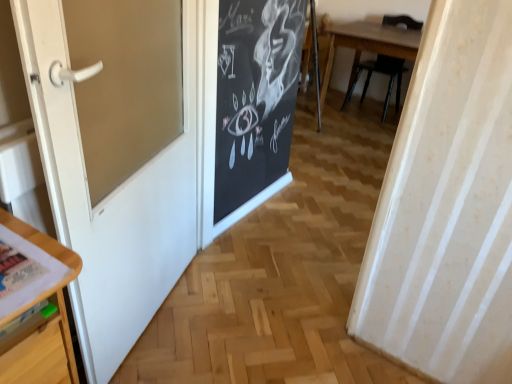
Question: From the image's perspective, does wooden chair at upper right appear lower than white glossy door at left?

Choices:
 (A) no
 (B) yes

Answer: (A)

Question: Is the position of wooden chair at upper right more distant than that of white glossy door at left?

Choices:
 (A) yes
 (B) no

Answer: (A)

Question: Considering the relative positions of wooden chair at upper right and white glossy door at left in the image provided, is wooden chair at upper right to the left of white glossy door at left from the viewer's perspective?

Choices:
 (A) no
 (B) yes

Answer: (A)

Question: Is wooden chair at upper right turned away from white glossy door at left?

Choices:
 (A) no
 (B) yes

Answer: (A)

Question: From a real-world perspective, is wooden chair at upper right located higher than white glossy door at left?

Choices:
 (A) yes
 (B) no

Answer: (B)

Question: From the image's perspective, is wooden chair at upper right located above white glossy door at left?

Choices:
 (A) yes
 (B) no

Answer: (A)

Question: From the image's perspective, is white glossy door at left under wooden chair at upper right?

Choices:
 (A) no
 (B) yes

Answer: (B)

Question: Does white glossy door at left appear on the left side of wooden chair at upper right?

Choices:
 (A) yes
 (B) no

Answer: (A)

Question: Is white glossy door at left closer to the viewer compared to wooden chair at upper right?

Choices:
 (A) yes
 (B) no

Answer: (A)

Question: Does white glossy door at left have a greater width compared to wooden chair at upper right?

Choices:
 (A) no
 (B) yes

Answer: (A)

Question: Considering the relative sizes of white glossy door at left and wooden chair at upper right in the image provided, is white glossy door at left smaller than wooden chair at upper right?

Choices:
 (A) yes
 (B) no

Answer: (A)

Question: Considering the relative sizes of white glossy door at left and wooden chair at upper right in the image provided, is white glossy door at left thinner than wooden chair at upper right?

Choices:
 (A) no
 (B) yes

Answer: (B)

Question: Is white glossy door at left inside the boundaries of wooden chair at upper right, or outside?

Choices:
 (A) outside
 (B) inside

Answer: (A)